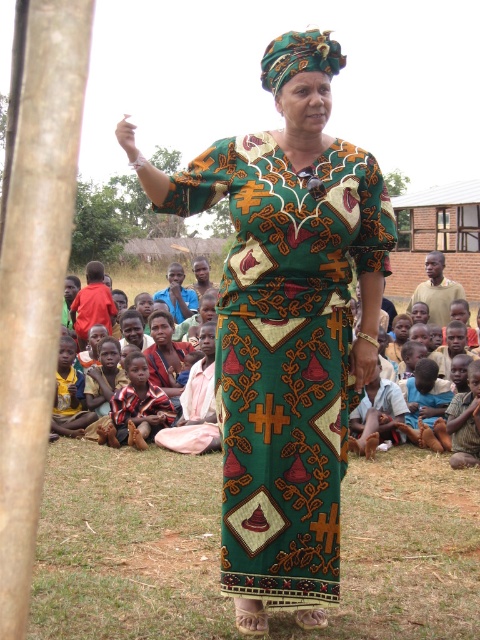
You are a photographer trying to capture the green woven dress at center and the brown rough tree trunk at left in the same frame. Based on their positions, which one should you focus on first to ensure both are in the frame?

The green woven dress at center is below the brown rough tree trunk at left, so you should focus on the brown rough tree trunk at left first to ensure both are in the frame.